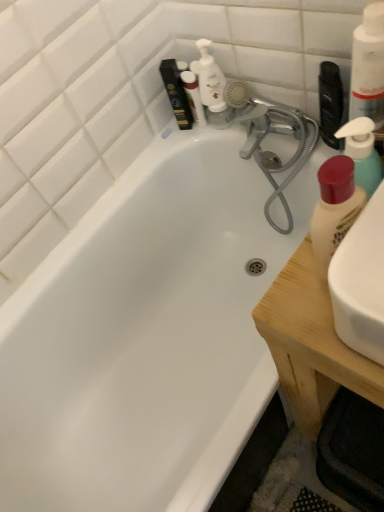
Question: Considering the relative positions of wooden at right and white plastic pump bottle at upper center in the image provided, is wooden at right to the left of white plastic pump bottle at upper center from the viewer's perspective?

Choices:
 (A) yes
 (B) no

Answer: (B)

Question: From a real-world perspective, is wooden at right located beneath white plastic pump bottle at upper center?

Choices:
 (A) no
 (B) yes

Answer: (B)

Question: Is wooden at right shorter than white plastic pump bottle at upper center?

Choices:
 (A) yes
 (B) no

Answer: (B)

Question: Does wooden at right have a smaller size compared to white plastic pump bottle at upper center?

Choices:
 (A) no
 (B) yes

Answer: (A)

Question: Considering the relative sizes of wooden at right and white plastic pump bottle at upper center in the image provided, is wooden at right taller than white plastic pump bottle at upper center?

Choices:
 (A) no
 (B) yes

Answer: (B)

Question: Considering the positions of point (279, 290) and point (369, 4), is point (279, 290) closer or farther from the camera than point (369, 4)?

Choices:
 (A) closer
 (B) farther

Answer: (B)

Question: From a real-world perspective, relative to white pump bottle at upper right, which is the first cleaning product from top to bottom, is wooden at right vertically above or below?

Choices:
 (A) above
 (B) below

Answer: (B)

Question: In terms of size, does wooden at right appear bigger or smaller than white pump bottle at upper right, which is the first cleaning product from top to bottom?

Choices:
 (A) big
 (B) small

Answer: (A)

Question: Is wooden at right wider or thinner than white pump bottle at upper right, which is the first cleaning product from top to bottom?

Choices:
 (A) wide
 (B) thin

Answer: (A)

Question: Is white plastic pump bottle at upper center taller or shorter than white pump bottle at upper right, the 3th cleaning product from the bottom?

Choices:
 (A) tall
 (B) short

Answer: (B)

Question: Is white plastic pump bottle at upper center situated inside white pump bottle at upper right, which is the first cleaning product from top to bottom, or outside?

Choices:
 (A) inside
 (B) outside

Answer: (B)

Question: Is white plastic pump bottle at upper center bigger or smaller than white pump bottle at upper right, which is the first cleaning product from top to bottom?

Choices:
 (A) big
 (B) small

Answer: (B)

Question: From a real-world perspective, is white plastic pump bottle at upper center positioned above or below white pump bottle at upper right, which is the first cleaning product from top to bottom?

Choices:
 (A) below
 (B) above

Answer: (A)

Question: Which is correct: wooden at right is inside matte white lotion at right, which appears as the first cleaning product when ordered from the bottom, or outside of it?

Choices:
 (A) inside
 (B) outside

Answer: (B)

Question: From a real-world perspective, is wooden at right physically located above or below matte white lotion at right, which appears as the first cleaning product when ordered from the bottom?

Choices:
 (A) above
 (B) below

Answer: (B)